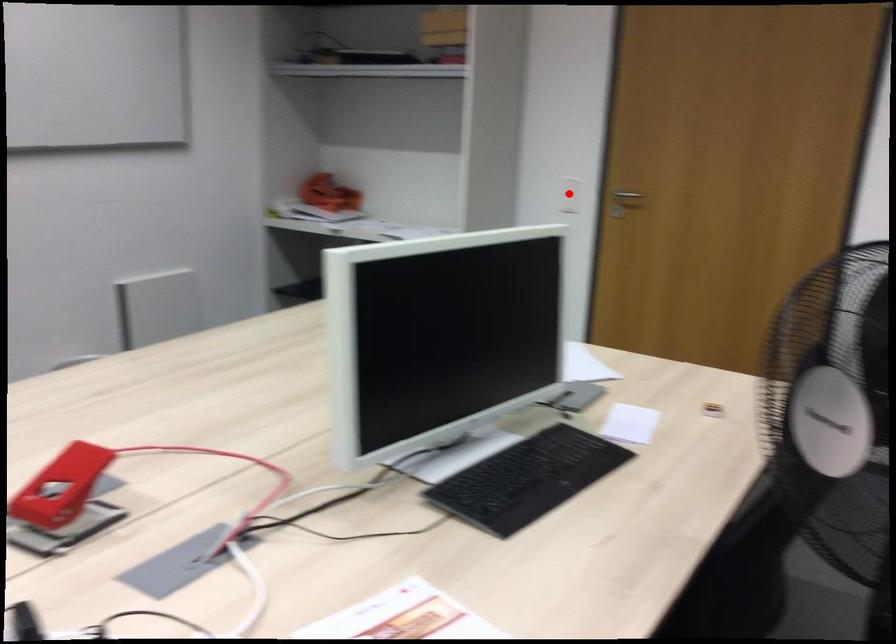
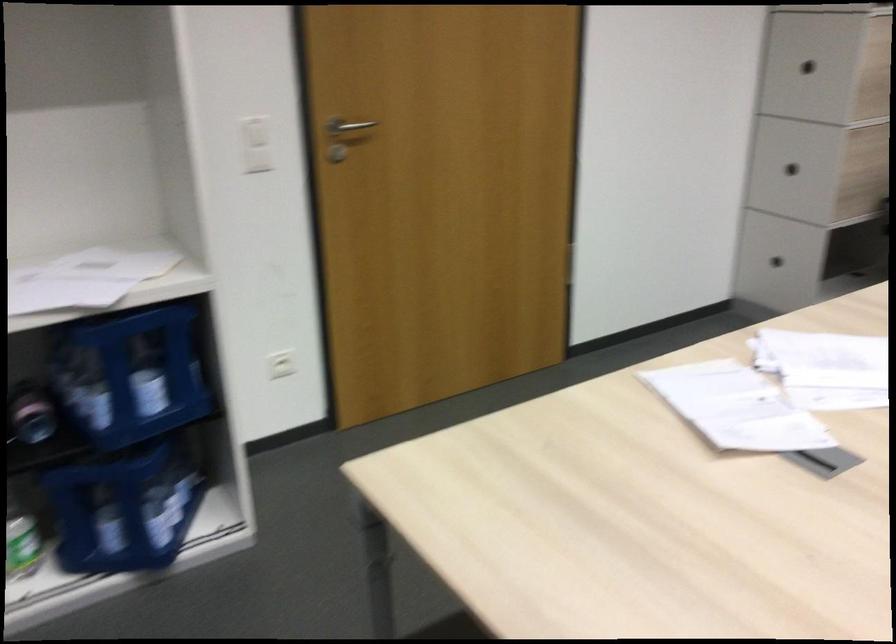
Question: I am providing you with two images of the same scene from different viewpoints. A red point is marked on the first image. Can you still see the location of the red point in image 2?

Choices:
 (A) Yes
 (B) No

Answer: (B)